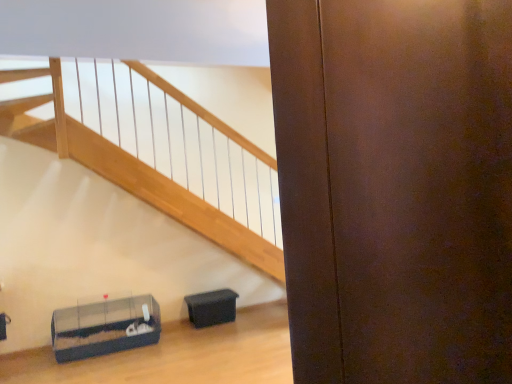
Question: Looking at the image, does black plastic container at lower center, placed as the 2th furniture when sorted from left to right, seem bigger or smaller compared to clear plastic cage at lower left, which appears as the 2th furniture when viewed from the right?

Choices:
 (A) small
 (B) big

Answer: (A)

Question: From a real-world perspective, relative to clear plastic cage at lower left, which appears as the 2th furniture when viewed from the right, is black plastic container at lower center, the 1th furniture viewed from the right, vertically above or below?

Choices:
 (A) above
 (B) below

Answer: (B)

Question: Looking at their shapes, would you say black plastic container at lower center, placed as the 2th furniture when sorted from left to right, is wider or thinner than clear plastic cage at lower left, the first furniture when ordered from left to right?

Choices:
 (A) wide
 (B) thin

Answer: (B)

Question: Is clear plastic cage at lower left, which appears as the 2th furniture when viewed from the right, situated inside black plastic container at lower center, placed as the 2th furniture when sorted from left to right, or outside?

Choices:
 (A) inside
 (B) outside

Answer: (B)

Question: Visually, is clear plastic cage at lower left, the first furniture when ordered from left to right, positioned to the left or to the right of black plastic container at lower center, placed as the 2th furniture when sorted from left to right?

Choices:
 (A) left
 (B) right

Answer: (A)

Question: From the image's perspective, is clear plastic cage at lower left, which appears as the 2th furniture when viewed from the right, above or below black plastic container at lower center, placed as the 2th furniture when sorted from left to right?

Choices:
 (A) below
 (B) above

Answer: (A)

Question: In terms of height, does clear plastic cage at lower left, the first furniture when ordered from left to right, look taller or shorter compared to black plastic container at lower center, placed as the 2th furniture when sorted from left to right?

Choices:
 (A) short
 (B) tall

Answer: (B)